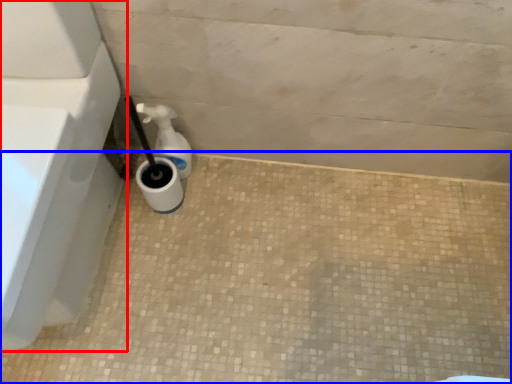
Question: Which object appears farthest to the camera in this image, bath (highlighted by a red box) or concrete (highlighted by a blue box)?

Choices:
 (A) bath
 (B) concrete

Answer: (B)